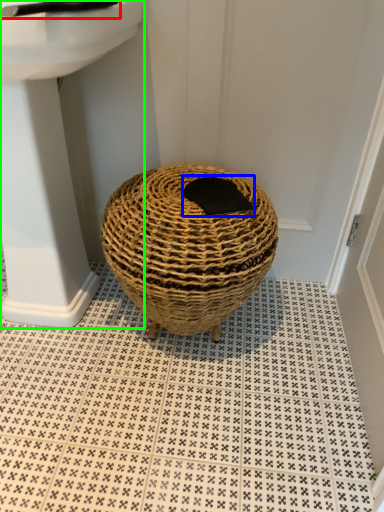
Question: Which object is the closest to the faucet (highlighted by a red box)? Choose among these: pad (highlighted by a blue box) or sink (highlighted by a green box).

Choices:
 (A) pad
 (B) sink

Answer: (B)